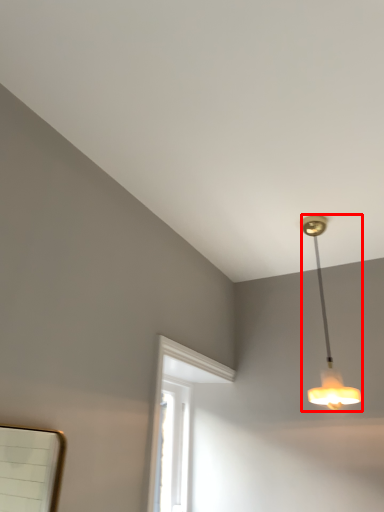
Question: Considering the relative positions of lamp (annotated by the red box) and window in the image provided, where is lamp (annotated by the red box) located with respect to the staircase?

Choices:
 (A) left
 (B) right

Answer: (B)